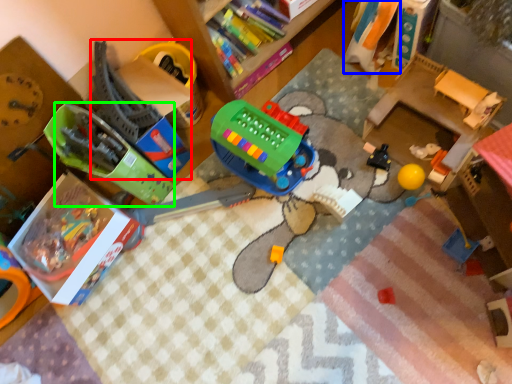
Question: Which is farther away from toy (highlighted by a red box)? toy (highlighted by a blue box) or toy (highlighted by a green box)?

Choices:
 (A) toy
 (B) toy

Answer: (A)